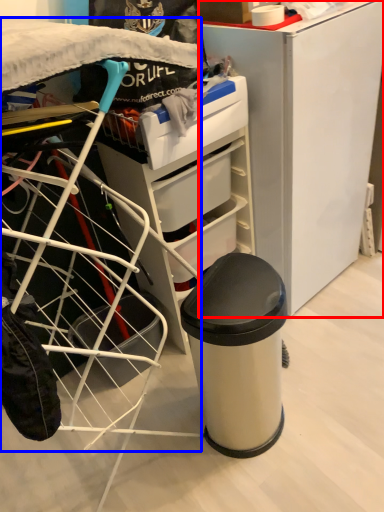
Question: Among these objects, which one is farthest to the camera, furniture (highlighted by a red box) or wide (highlighted by a blue box)?

Choices:
 (A) furniture
 (B) wide

Answer: (A)